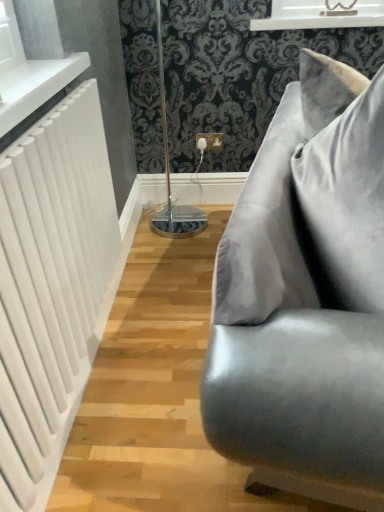
Question: From a real-world perspective, does satin gray pillow at right sit lower than white glossy window frame at upper center?

Choices:
 (A) no
 (B) yes

Answer: (B)

Question: Is satin gray pillow at right touching white glossy window frame at upper center?

Choices:
 (A) no
 (B) yes

Answer: (A)

Question: Does satin gray pillow at right have a lesser width compared to white glossy window frame at upper center?

Choices:
 (A) yes
 (B) no

Answer: (A)

Question: From a real-world perspective, is satin gray pillow at right on top of white glossy window frame at upper center?

Choices:
 (A) no
 (B) yes

Answer: (A)

Question: Can white glossy window frame at upper center be found inside satin gray pillow at right?

Choices:
 (A) yes
 (B) no

Answer: (B)

Question: Choose the correct answer: Is white glossy window frame at upper center inside white glossy radiator at upper left or outside it?

Choices:
 (A) outside
 (B) inside

Answer: (A)

Question: Is white glossy window frame at upper center to the left or to the right of white glossy radiator at upper left in the image?

Choices:
 (A) left
 (B) right

Answer: (B)

Question: Considering the positions of point (372, 8) and point (6, 90), is point (372, 8) closer or farther from the camera than point (6, 90)?

Choices:
 (A) farther
 (B) closer

Answer: (A)

Question: From a real-world perspective, is white glossy window frame at upper center physically located above or below white glossy radiator at upper left?

Choices:
 (A) below
 (B) above

Answer: (B)

Question: Considering the positions of point (x=52, y=241) and point (x=370, y=16), is point (x=52, y=241) closer or farther from the camera than point (x=370, y=16)?

Choices:
 (A) closer
 (B) farther

Answer: (A)

Question: Considering the positions of white matte radiator at left and white glossy window frame at upper center in the image, is white matte radiator at left bigger or smaller than white glossy window frame at upper center?

Choices:
 (A) small
 (B) big

Answer: (B)

Question: Considering the relative positions of white matte radiator at left and white glossy window frame at upper center in the image provided, is white matte radiator at left to the left or to the right of white glossy window frame at upper center?

Choices:
 (A) right
 (B) left

Answer: (B)

Question: In terms of width, does white matte radiator at left look wider or thinner when compared to white glossy window frame at upper center?

Choices:
 (A) wide
 (B) thin

Answer: (B)

Question: Is satin gray pillow at right wider or thinner than satin gray couch at right?

Choices:
 (A) wide
 (B) thin

Answer: (B)

Question: Is satin gray pillow at right to the left or to the right of satin gray couch at right in the image?

Choices:
 (A) right
 (B) left

Answer: (B)